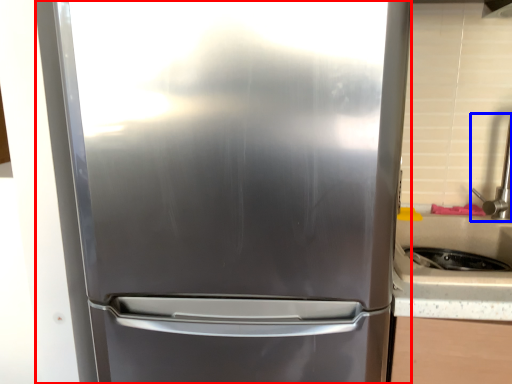
Question: Which point is closer to the camera, refrigerator (highlighted by a red box) or faucet (highlighted by a blue box)?

Choices:
 (A) refrigerator
 (B) faucet

Answer: (A)